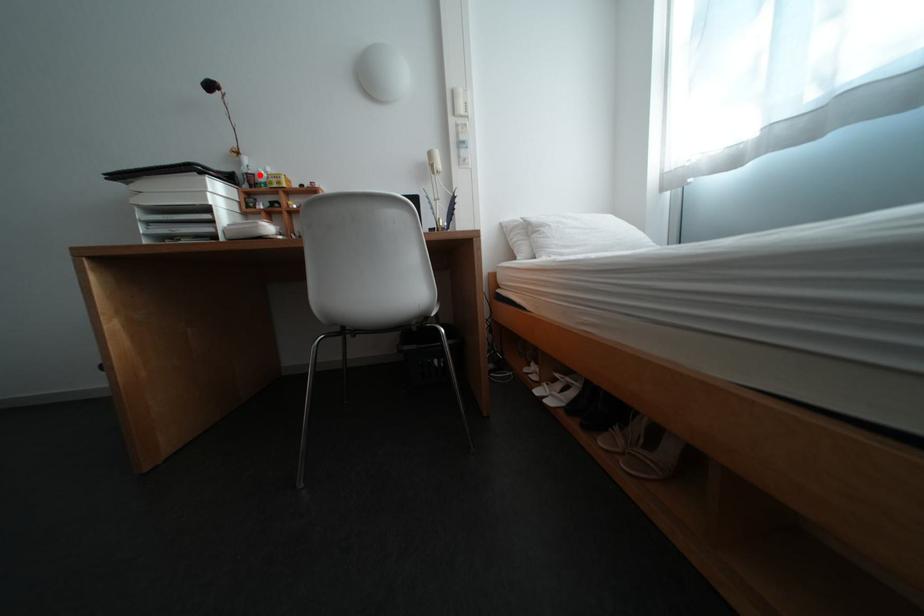
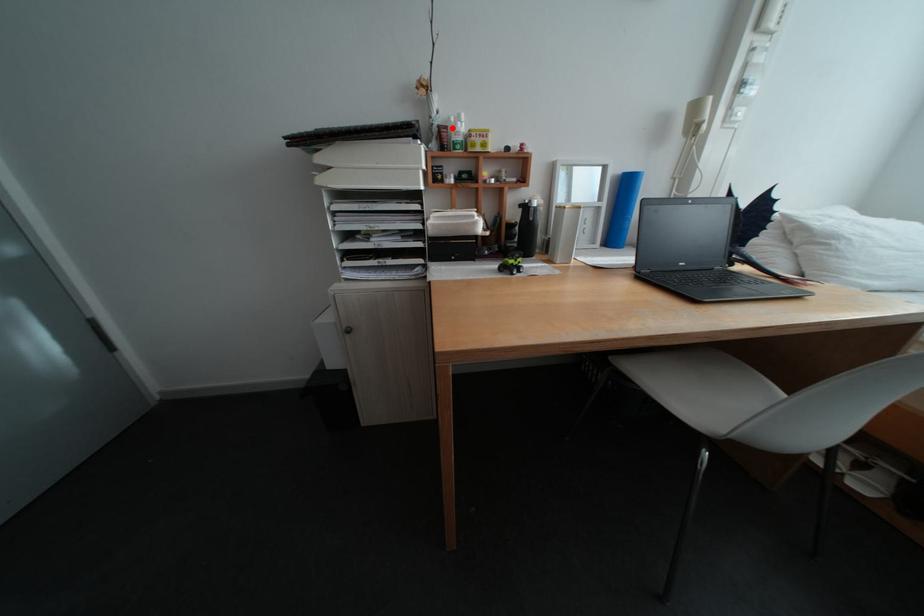
I am providing you with two images of the same scene from different viewpoints. A red point is marked on the first image and another point is marked on the second image. Is the red point in image1 aligned with the point shown in image2?

Yes